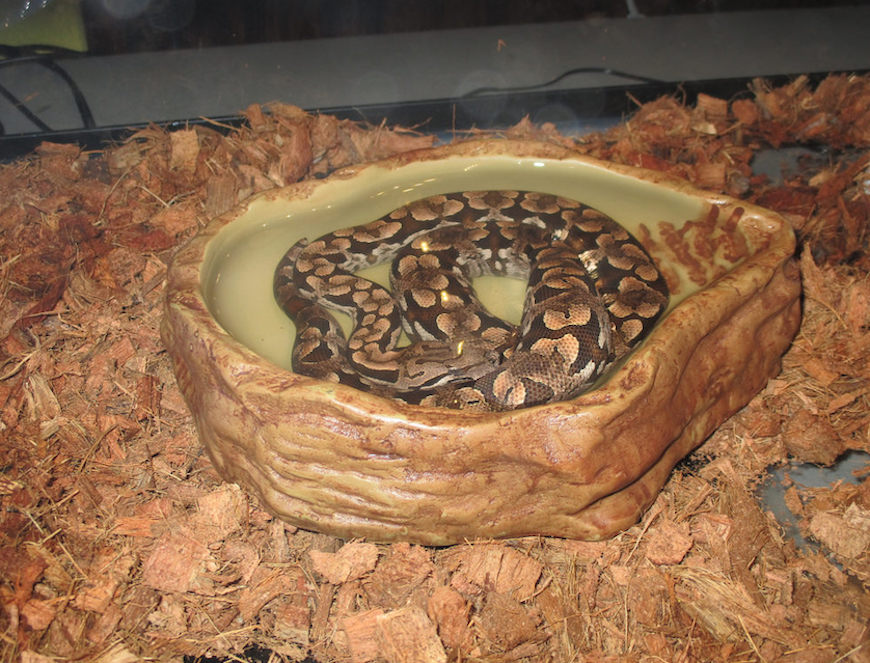
What are the coordinates of `water dish interior` in the screenshot? It's located at (256, 306).